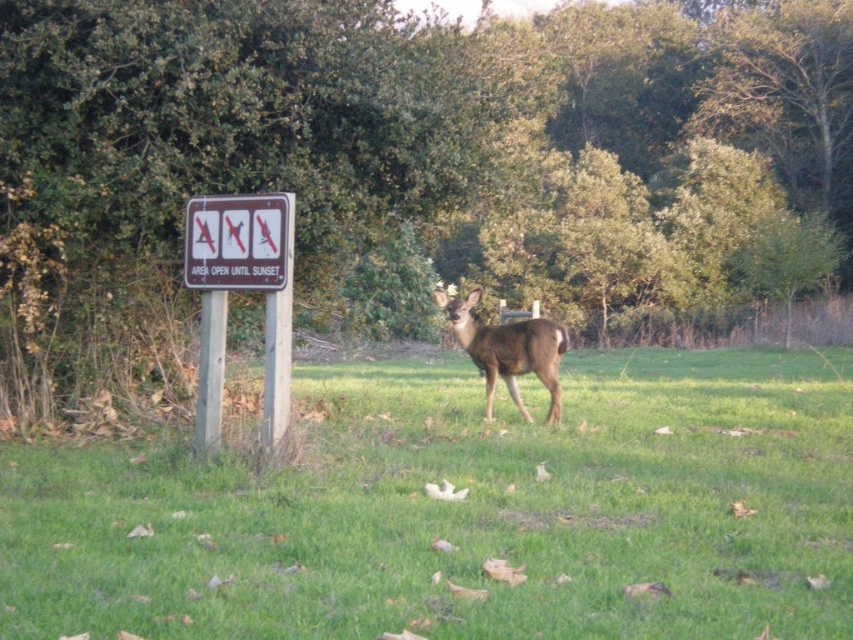
Question: Which object is the closest to the metallic rectangular sign at center?

Choices:
 (A) green grass at center
 (B) brown matte deer at center
 (C) brown wooden sign at left

Answer: (C)

Question: Which point is closer to the camera taking this photo?

Choices:
 (A) (198, 243)
 (B) (271, 230)
 (C) (543, 374)

Answer: (B)

Question: Is brown wooden sign at left smaller than brown matte deer at center?

Choices:
 (A) no
 (B) yes

Answer: (B)

Question: Which object appears farthest from the camera in this image?

Choices:
 (A) green grass at center
 (B) brown wooden sign at left

Answer: (B)

Question: Is green grass at center to the right of brown wooden sign at left from the viewer's perspective?

Choices:
 (A) yes
 (B) no

Answer: (A)

Question: Does brown wooden sign at left appear on the right side of metallic rectangular sign at center?

Choices:
 (A) no
 (B) yes

Answer: (B)